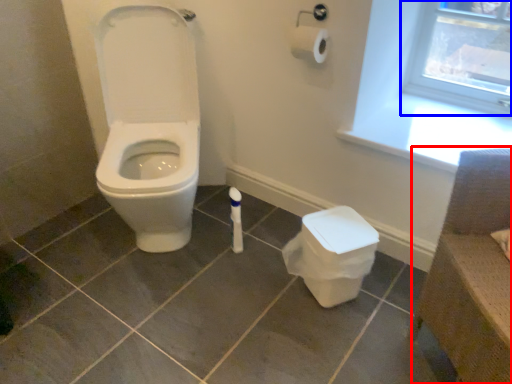
Question: Which object appears farthest to the camera in this image, chair (highlighted by a red box) or window frame (highlighted by a blue box)?

Choices:
 (A) chair
 (B) window frame

Answer: (B)